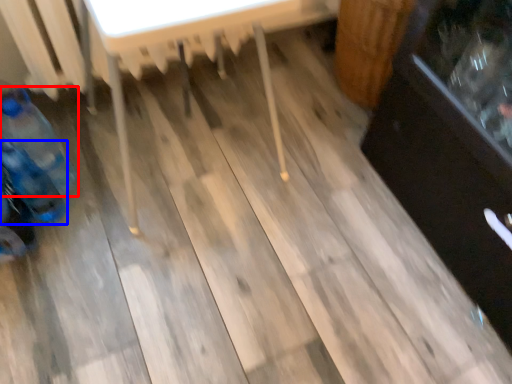
Question: Which point is closer to the camera, bottle (highlighted by a red box) or bottle (highlighted by a blue box)?

Choices:
 (A) bottle
 (B) bottle

Answer: (B)